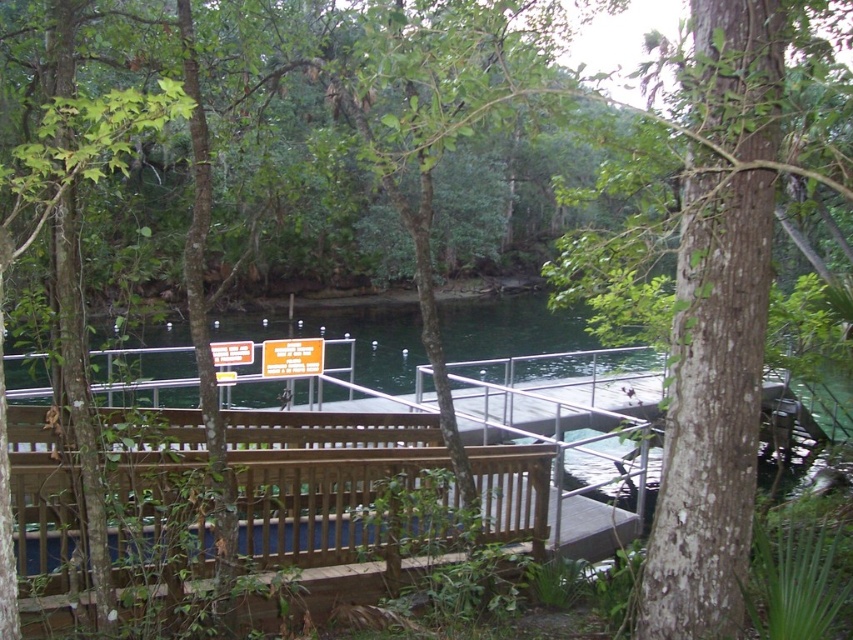
Question: Which point is closer to the camera?

Choices:
 (A) yellow plastic sign at center
 (B) orange plastic sign at center

Answer: (B)

Question: Which object is closer to the camera taking this photo?

Choices:
 (A) yellow plastic sign at center
 (B) orange plastic sign at center

Answer: (B)

Question: Is yellow plastic sign at center above orange plastic sign at center?

Choices:
 (A) no
 (B) yes

Answer: (B)

Question: Can you confirm if yellow plastic sign at center is thinner than orange plastic sign at center?

Choices:
 (A) no
 (B) yes

Answer: (B)

Question: Which object is farther from the camera taking this photo?

Choices:
 (A) orange plastic sign at center
 (B) yellow plastic sign at center

Answer: (B)

Question: Can you confirm if yellow plastic sign at center is positioned to the left of orange plastic sign at center?

Choices:
 (A) no
 (B) yes

Answer: (A)